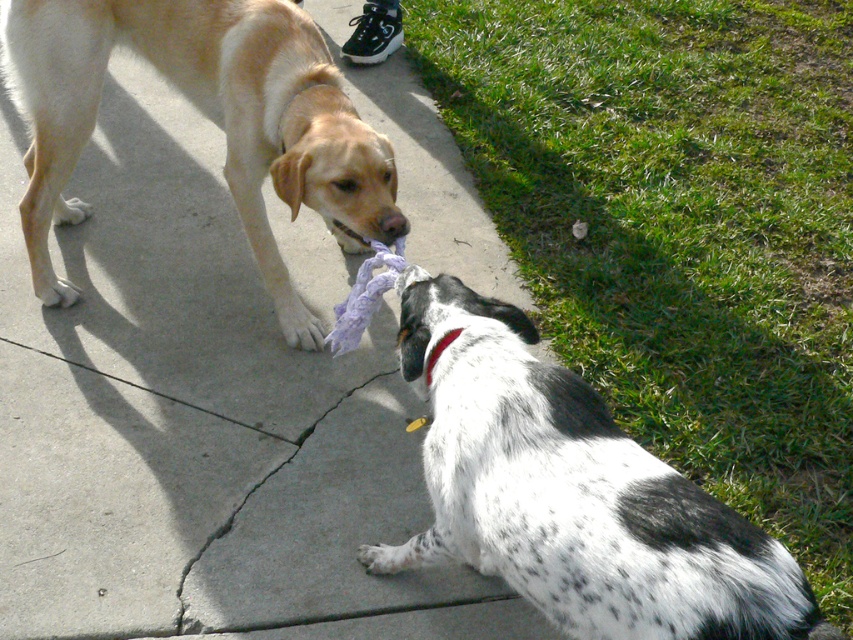
Which is more to the right, light brown fur at left or black fabric neckband at center?

black fabric neckband at center is more to the right.

Does point (73, 301) come behind point (437, 344)?

Yes, point (73, 301) is behind point (437, 344).

Locate an element on the screen. The width and height of the screenshot is (853, 640). light brown fur at left is located at coordinates (207, 116).

Measure the distance between spotted fur dog at lower right and camera.

The distance of spotted fur dog at lower right from camera is 1.46 meters.

Does spotted fur dog at lower right appear on the right side of light brown fur at left?

Correct, you'll find spotted fur dog at lower right to the right of light brown fur at left.

Is point (672, 476) farther from viewer compared to point (77, 76)?

That is False.

This screenshot has width=853, height=640. Identify the location of spotted fur dog at lower right. [572, 493].

Can you confirm if spotted fur dog at lower right is positioned to the left of black fabric neckband at center?

In fact, spotted fur dog at lower right is to the right of black fabric neckband at center.

Does spotted fur dog at lower right come in front of black fabric neckband at center?

That is True.

Is point (776, 550) farther from camera compared to point (432, 365)?

That is False.

Identify the location of spotted fur dog at lower right. This screenshot has width=853, height=640. (572, 493).